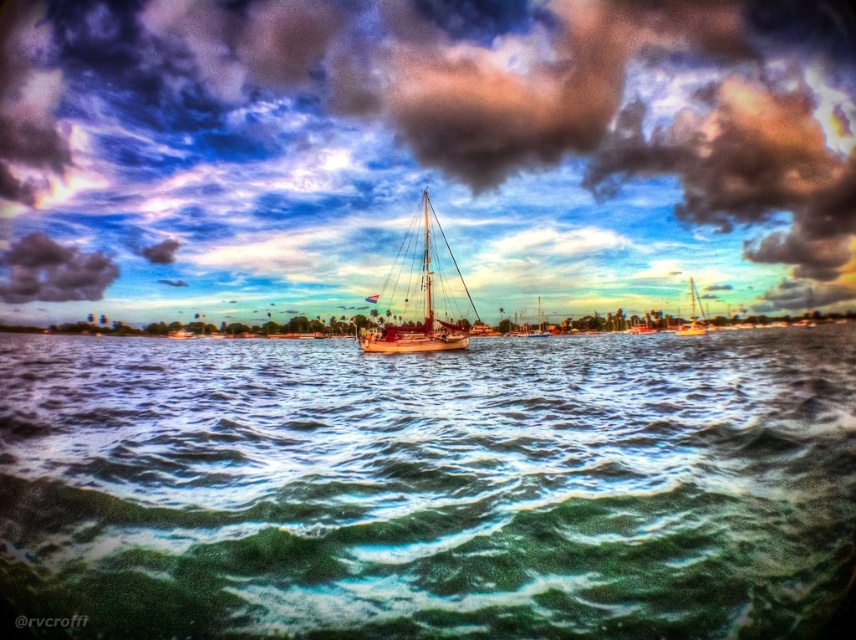
In the scene shown: Can you confirm if dark gray cloud at upper left is thinner than wooden sailboat at center?

In fact, dark gray cloud at upper left might be wider than wooden sailboat at center.

Who is more distant from viewer, (82, 272) or (417, 340)?

The point (82, 272) is behind.

Is point (19, 298) behind point (449, 328)?

Yes, point (19, 298) is behind point (449, 328).

Identify the location of dark gray cloud at upper left. (52, 272).

Is green wavy water at center smaller than dark gray cloud at upper left?

Incorrect, green wavy water at center is not smaller in size than dark gray cloud at upper left.

Is green wavy water at center shorter than dark gray cloud at upper left?

Correct, green wavy water at center is not as tall as dark gray cloud at upper left.

The image size is (856, 640). What are the coordinates of `green wavy water at center` in the screenshot? It's located at (428, 486).

From the picture: Can you confirm if dark gray cloud at upper center is wider than shiny white sailboat at right?

Yes.

Is dark gray cloud at upper center shorter than shiny white sailboat at right?

Incorrect, dark gray cloud at upper center's height does not fall short of shiny white sailboat at right's.

Between point (328, 20) and point (694, 321), which one is positioned behind?

Point (694, 321)

The image size is (856, 640). In order to click on dark gray cloud at upper center in this screenshot , I will do `click(434, 144)`.